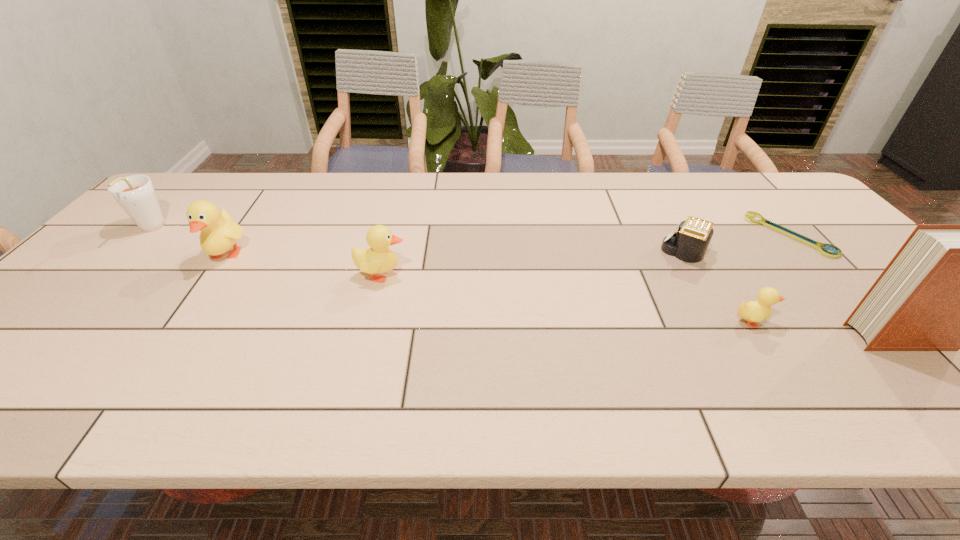
This screenshot has width=960, height=540. In order to click on vacant space located on the front-facing side of the shortest duckling in this screenshot , I will do `click(918, 321)`.

Locate an element on the screen. vacant space located 0.260m on the back of the shortest object is located at coordinates (733, 174).

Locate an element on the screen. free space located 0.090m on the drink side of the leftmost object is located at coordinates (117, 263).

Where is `blank area located on the right of the calculator`? blank area located on the right of the calculator is located at coordinates (841, 253).

The height and width of the screenshot is (540, 960). Identify the location of object that is at the left edge. (135, 194).

The image size is (960, 540). What are the coordinates of `object that is at the right edge` in the screenshot? It's located at (750, 215).

I want to click on vacant area at the far edge, so click(501, 186).

The width and height of the screenshot is (960, 540). In order to click on free location at the left edge of the desktop in this screenshot , I will do `click(78, 320)`.

The height and width of the screenshot is (540, 960). I want to click on vacant space at the far right corner, so click(800, 204).

I want to click on empty space between the calculator and the fourth tallest object, so [x=534, y=264].